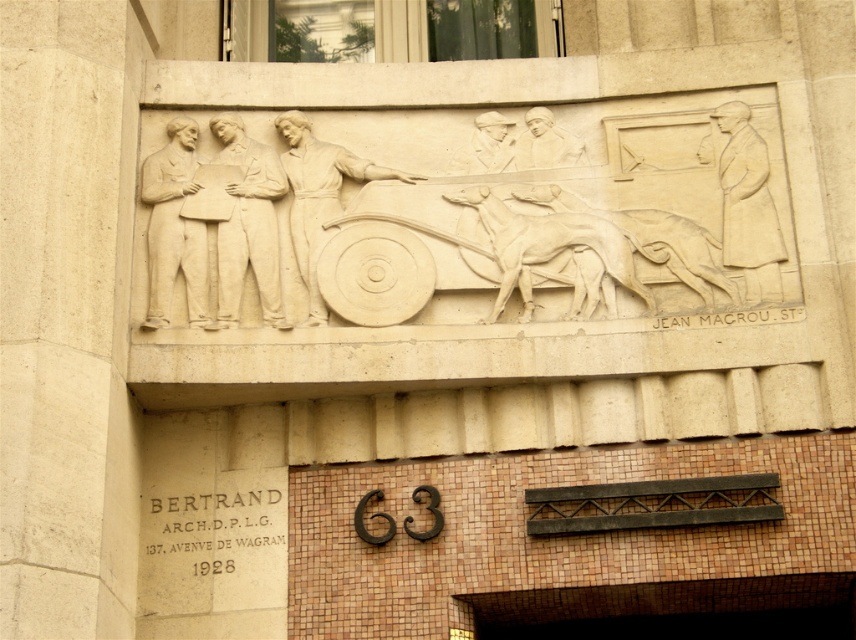
Question: Which point is closer to the camera taking this photo?

Choices:
 (A) (403, 288)
 (B) (271, 266)

Answer: (A)

Question: Is brown mosaic tile at lower center thinner than white stone figures at left?

Choices:
 (A) no
 (B) yes

Answer: (A)

Question: Which is farther from the white stone horses at center?

Choices:
 (A) white stone relief at center
 (B) matte beige figure at upper right

Answer: (A)

Question: Among these points, which one is farthest from the camera?

Choices:
 (A) (348, 170)
 (B) (815, 609)
 (C) (204, 260)

Answer: (A)

Question: Is beige stone figure at upper left below matte stone man at center?

Choices:
 (A) no
 (B) yes

Answer: (B)

Question: Is white stone figures at left further to the viewer compared to white stone shield at center?

Choices:
 (A) yes
 (B) no

Answer: (B)